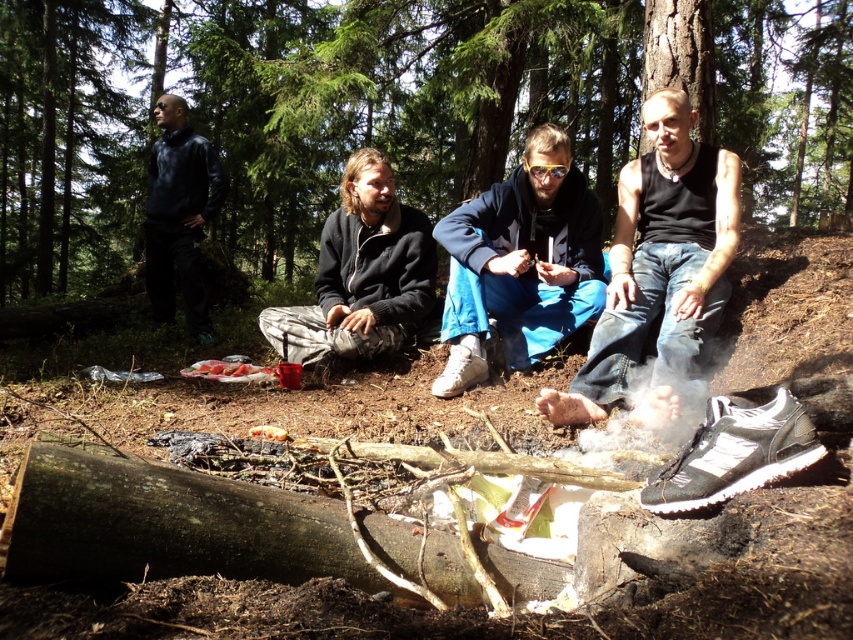
Consider the image. You are a hiker who wants to choose between the dark gray fleece jacket at center and the dark blue fleece at upper left based on their height. Which one is taller?

The dark blue fleece at upper left is taller than the dark gray fleece jacket at center.

You are a hiker who wants to take a photo of the blue fleece jacket at center and the brown wood tree at center. Which object will appear closer to the camera in the photo?

The brown wood tree at center will appear closer to the camera in the photo because the blue fleece jacket at center is behind it.

You are standing in the forest scene and want to hang the blue fleece jacket at center on the brown wood tree at center. Is the tree tall enough to accommodate the jacket without it touching the ground?

The brown wood tree at center is taller than the blue fleece jacket at center, so yes, the tree is tall enough to hang the jacket without it touching the ground.